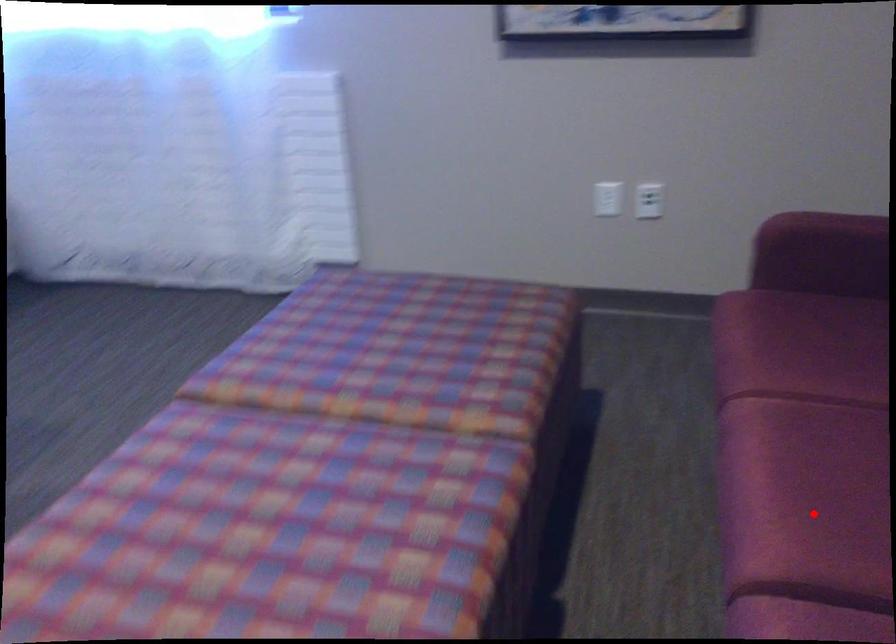
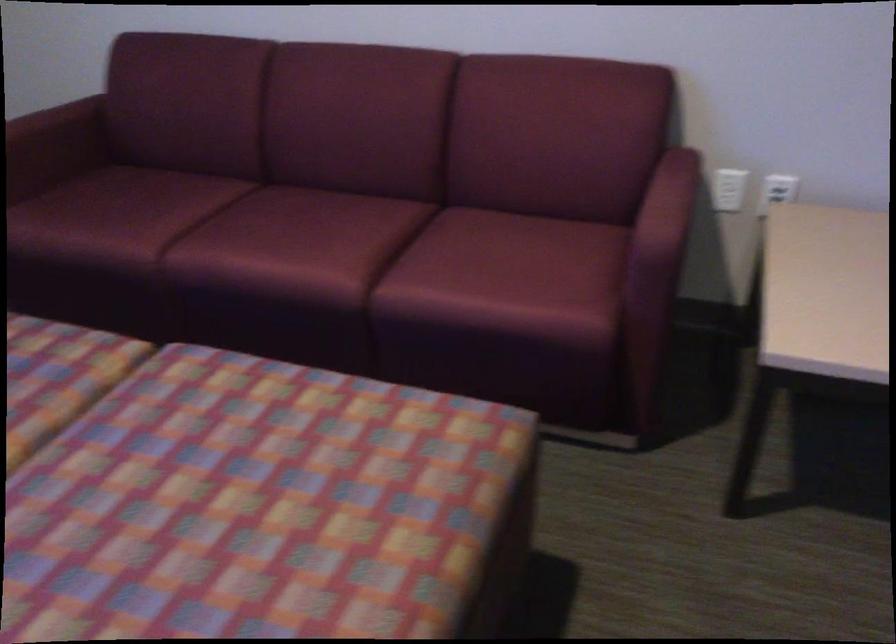
Find the pixel in the second image that matches the highlighted location in the first image.

(332, 249)